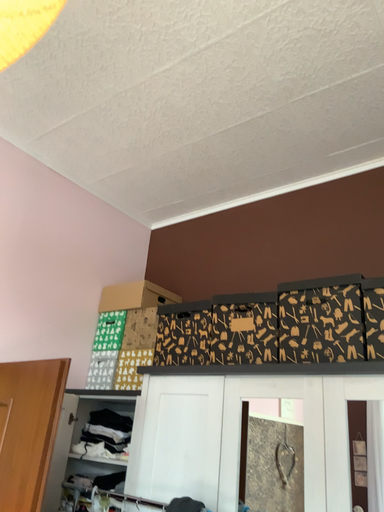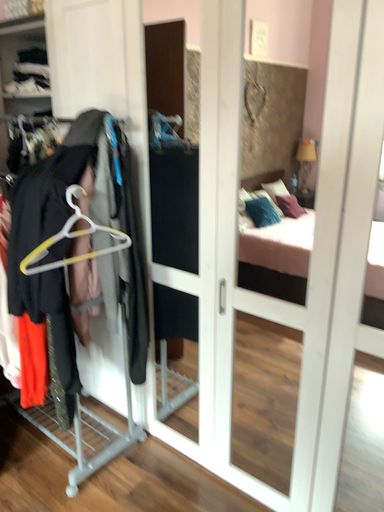
Question: Which way did the camera rotate in the video?

Choices:
 (A) rotated upward
 (B) rotated downward

Answer: (B)